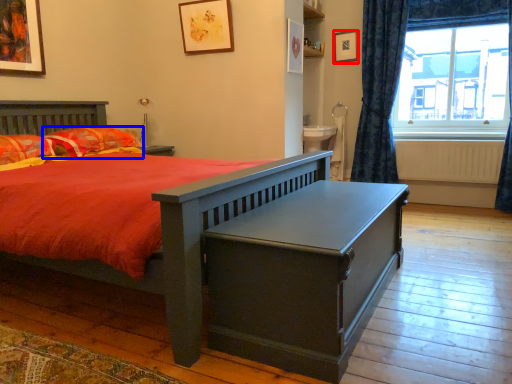
Question: Among these objects, which one is farthest to the camera, picture frame (highlighted by a red box) or pillow (highlighted by a blue box)?

Choices:
 (A) picture frame
 (B) pillow

Answer: (A)